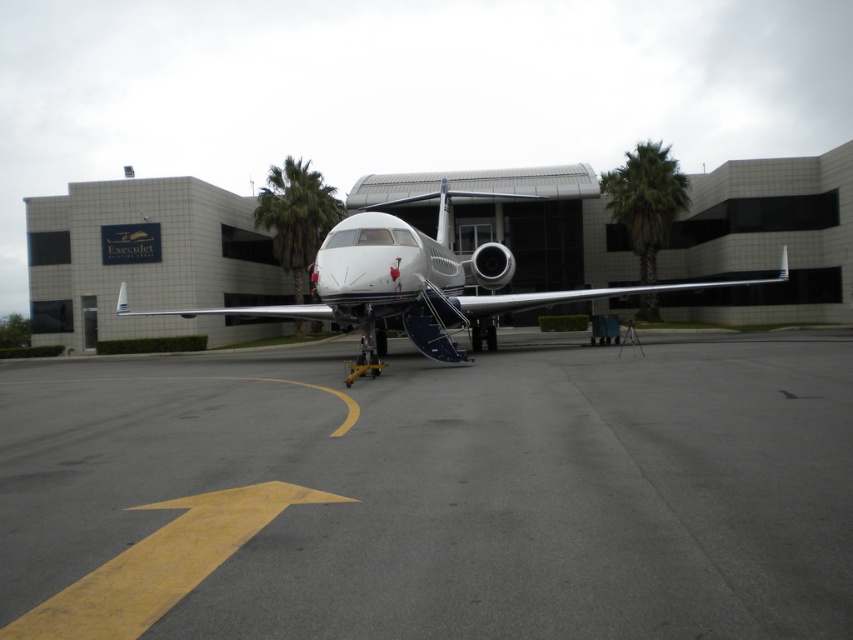
Question: Does gray asphalt tarmac at center appear under white metallic airplane at center?

Choices:
 (A) yes
 (B) no

Answer: (A)

Question: Can you confirm if gray asphalt tarmac at center is wider than white metallic airplane at center?

Choices:
 (A) no
 (B) yes

Answer: (A)

Question: Which of the following is the closest to the observer?

Choices:
 (A) white metallic airplane at center
 (B) gray asphalt tarmac at center

Answer: (B)

Question: Which point is closer to the camera?

Choices:
 (A) white metallic airplane at center
 (B) gray asphalt tarmac at center

Answer: (B)

Question: Can you confirm if gray asphalt tarmac at center is smaller than white metallic airplane at center?

Choices:
 (A) yes
 (B) no

Answer: (A)